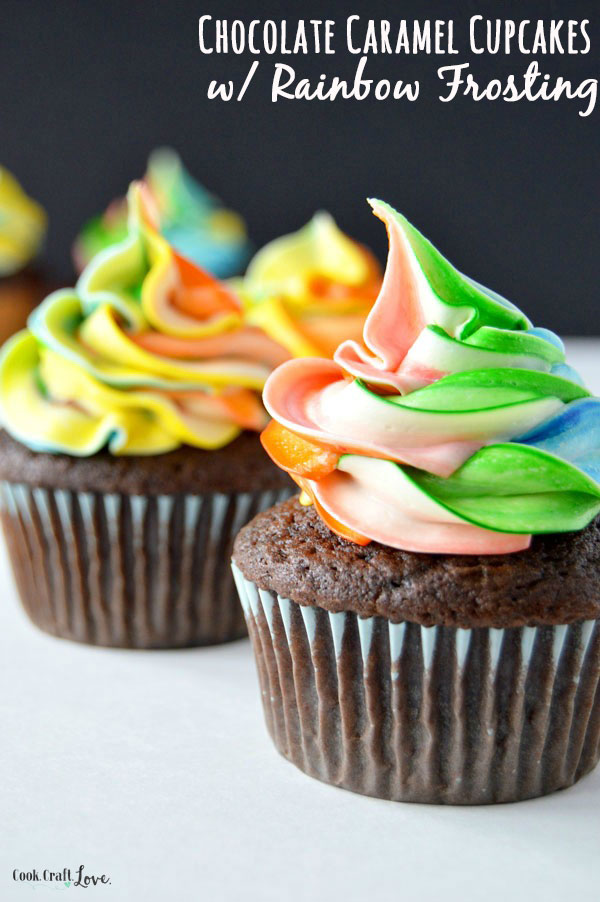
Where is `white counter top`? white counter top is located at coordinates (113, 751).